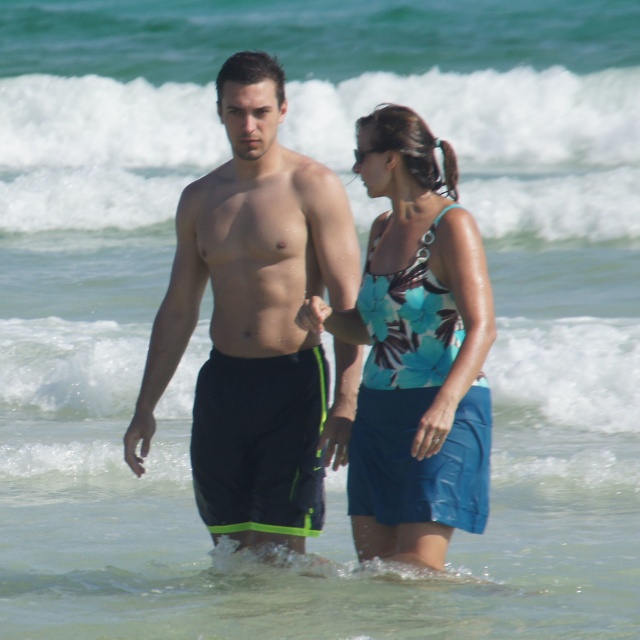
Does black matte shorts at center have a smaller size compared to matte black hand at center?

Incorrect, black matte shorts at center is not smaller in size than matte black hand at center.

Does black matte shorts at center have a greater width compared to matte black hand at center?

Correct, the width of black matte shorts at center exceeds that of matte black hand at center.

Is point (305, 438) closer to viewer compared to point (321, 305)?

That is False.

The width and height of the screenshot is (640, 640). I want to click on black matte shorts at center, so click(x=257, y=323).

Who is higher up, black matte shorts at center or blue fabric dress at center?

black matte shorts at center is above.

Identify the location of black matte shorts at center. (257, 323).

Where is `black matte shorts at center`? This screenshot has width=640, height=640. black matte shorts at center is located at coordinates (257, 323).

Is blue fabric dress at center taller than matte black hand at center?

Correct, blue fabric dress at center is much taller as matte black hand at center.

Does blue fabric dress at center appear on the right side of matte black hand at center?

Correct, you'll find blue fabric dress at center to the right of matte black hand at center.

Between point (467, 401) and point (314, 316), which one is positioned behind?

The point (467, 401) is more distant.

Identify the location of blue fabric dress at center. This screenshot has width=640, height=640. (417, 352).